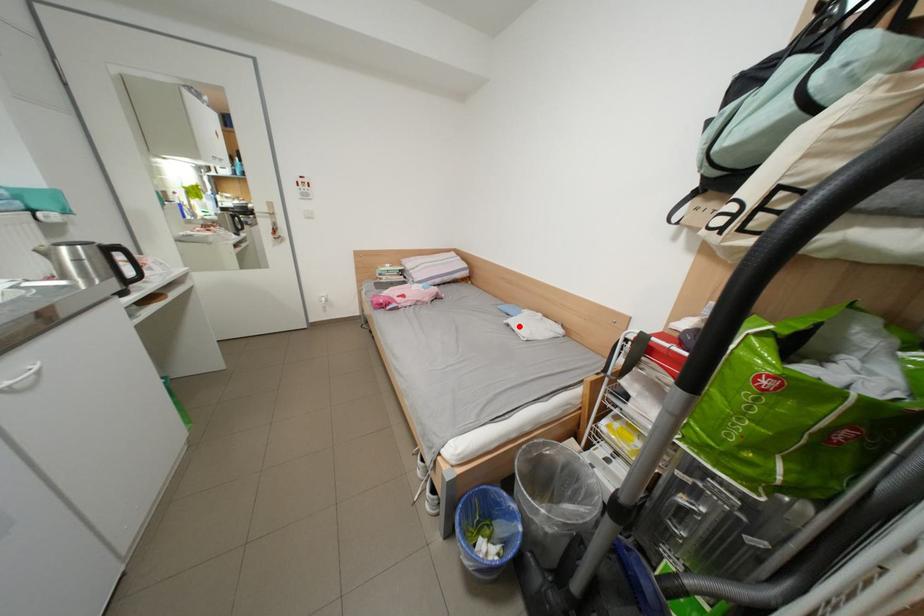
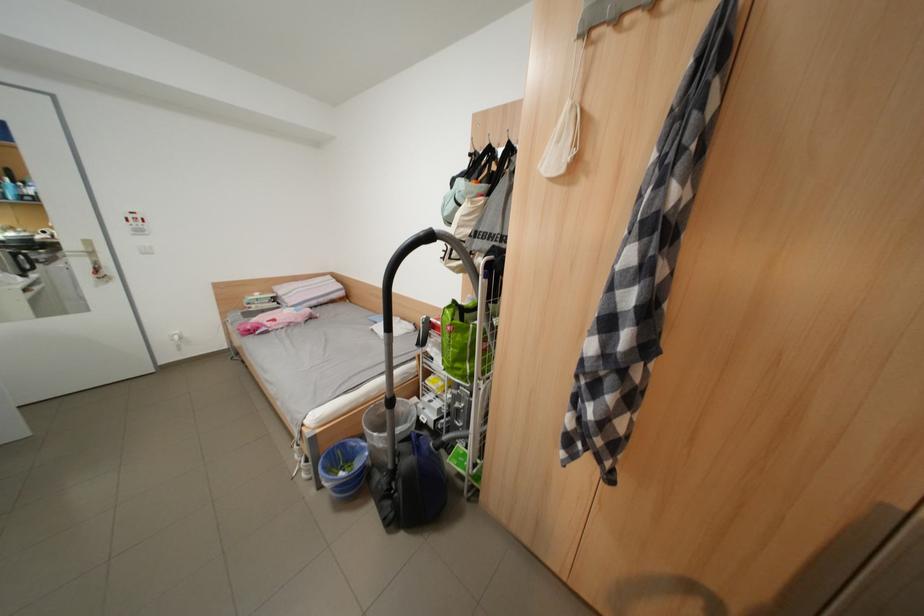
Question: I am providing you with two images of the same scene from different viewpoints. A red point is shown in image1. For the corresponding object point in image2, is it positioned nearer or farther from the camera?

Choices:
 (A) Nearer
 (B) Farther

Answer: (B)